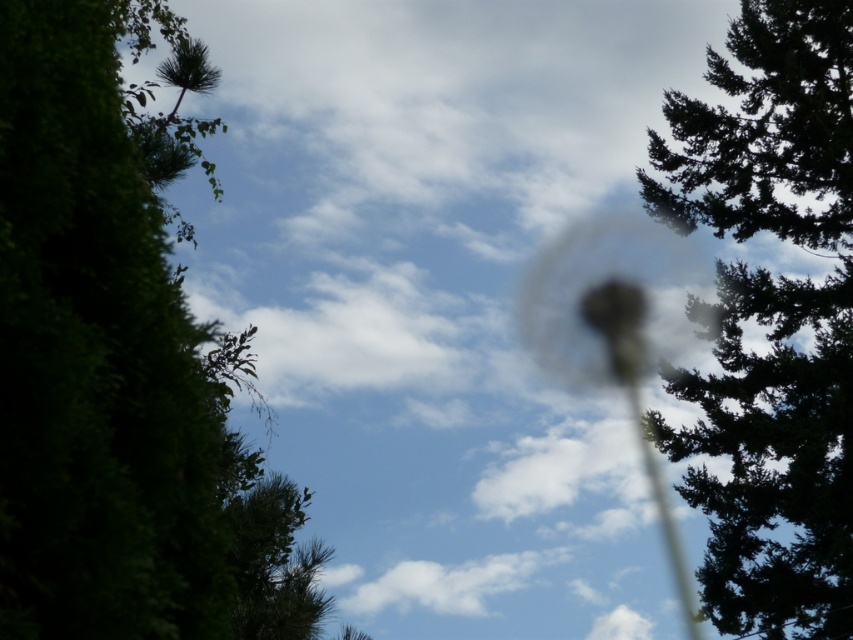
Is green leafy tree at left smaller than green textured tree at upper right?

Correct, green leafy tree at left occupies less space than green textured tree at upper right.

Is green leafy tree at left wider than green textured tree at upper right?

No.

Between point (80, 492) and point (770, 586), which one is positioned behind?

The point (770, 586) is behind.

Identify the location of green leafy tree at left. (120, 364).